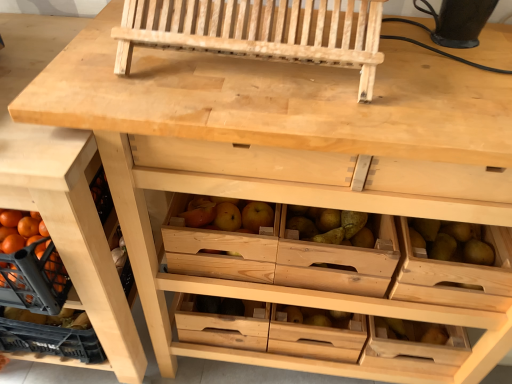
Question: Considering the positions of natural wood drawer at lower left and wooden drawer at center, which is the second drawer in right-to-left order, in the image, is natural wood drawer at lower left taller or shorter than wooden drawer at center, which is the second drawer in right-to-left order,?

Choices:
 (A) tall
 (B) short

Answer: (A)

Question: In terms of width, does natural wood drawer at lower left look wider or thinner when compared to wooden drawer at center, arranged as the first drawer when viewed from the back?

Choices:
 (A) wide
 (B) thin

Answer: (A)

Question: Estimate the real-world distances between objects in this image. Which object is farther from the natural wood drawer at lower left?

Choices:
 (A) wooden drawer at right, the second drawer viewed from the left
 (B) wooden drawer at center, acting as the first drawer starting from the left
 (C) natural wood church bench at upper center

Answer: (A)

Question: Which is farther from the natural wood drawer at lower left?

Choices:
 (A) wooden drawer at center, positioned as the second drawer in top-to-bottom order
 (B) wooden drawer at right, the first drawer when ordered from front to back
 (C) natural wood church bench at upper center

Answer: (B)